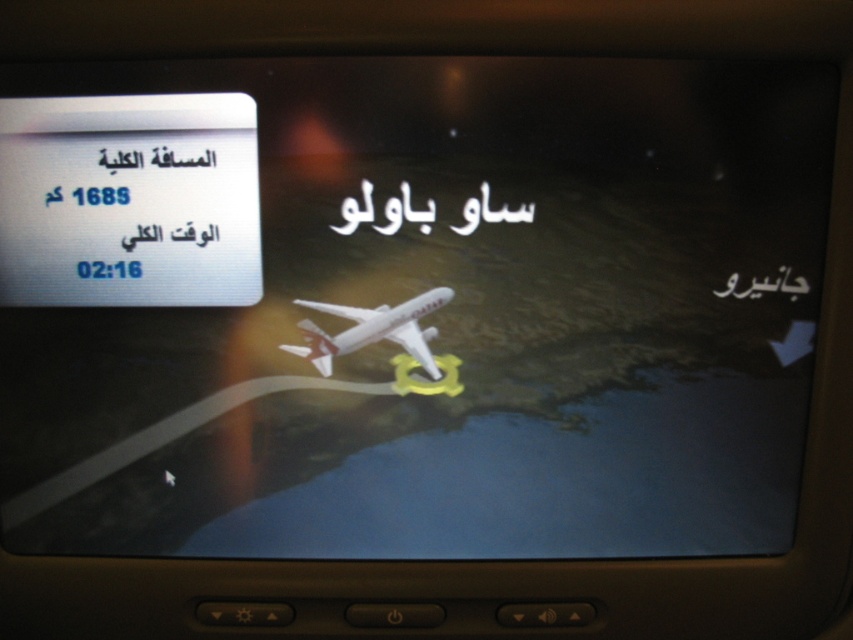
You are a passenger on a Qatar flight and looking at the in flight entertainment screen. You see a white paper at upper left and a black paper text at upper center. Which one is taller?

The white paper at upper left is taller than black paper text at upper center.

You are a flight attendant checking the in flight entertainment screen. You see a white paper at upper left and a black paper text at upper center. Which one is lower?

The white paper at upper left is positioned under black paper text at upper center, so the white paper at upper left is lower than the black paper text at upper center.

You are a flight attendant who needs to check the flight information displayed on the screen. The white paper at upper left and the white matte airplane at center are both visible. Which object is taller?

The white paper at upper left is taller than the white matte airplane at center.